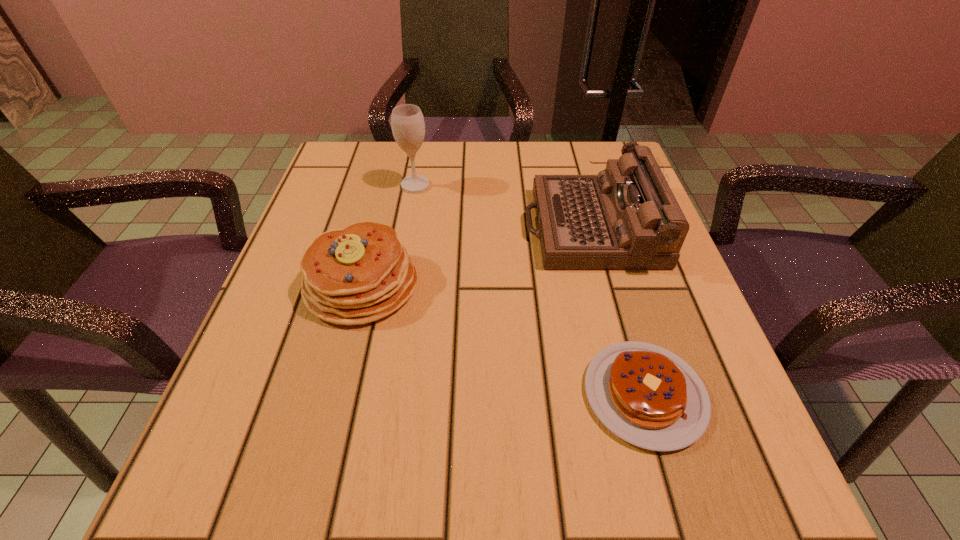
This screenshot has width=960, height=540. I want to click on free space located on the right of the farther pancake, so 617,285.

Find the location of a particular element. The image size is (960, 540). vacant region located 0.300m on the back of the shorter pancake is located at coordinates (596, 225).

The image size is (960, 540). What are the coordinates of `wineglass situated at the far edge` in the screenshot? It's located at (408, 127).

The image size is (960, 540). Identify the location of typewriter present at the far edge. (625, 218).

Identify the location of object that is at the near edge. (648, 396).

The image size is (960, 540). Identify the location of object that is at the left edge. click(x=359, y=274).

In order to click on typewriter positioned at the right edge in this screenshot , I will do `click(625, 218)`.

Where is `pancake that is at the right edge`? pancake that is at the right edge is located at coordinates (648, 396).

At what (x,y) coordinates should I click in order to perform the action: click on object that is at the far right corner. Please return your answer as a coordinate pair (x, y). Image resolution: width=960 pixels, height=540 pixels. Looking at the image, I should click on (625, 218).

You are a GUI agent. You are given a task and a screenshot of the screen. Output one action in this format:
    pyautogui.click(x=<x>, y=<y>)
    Task: Click on the object located at the near right corner
    The width and height of the screenshot is (960, 540).
    Given the screenshot: What is the action you would take?
    pyautogui.click(x=648, y=396)